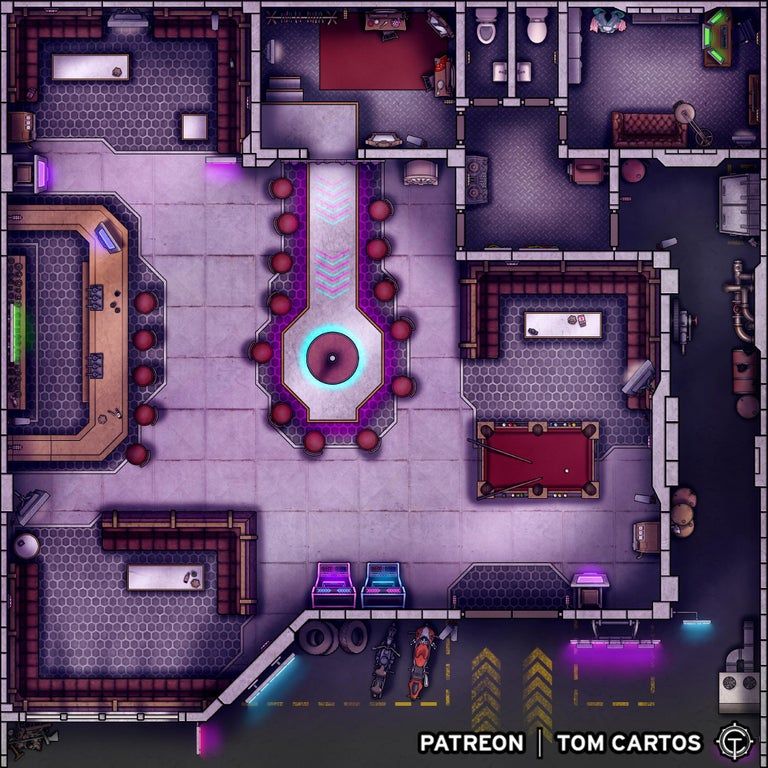
This screenshot has height=768, width=768. I want to click on toilet, so click(x=535, y=22), click(x=485, y=30), click(x=490, y=12), click(x=545, y=10).